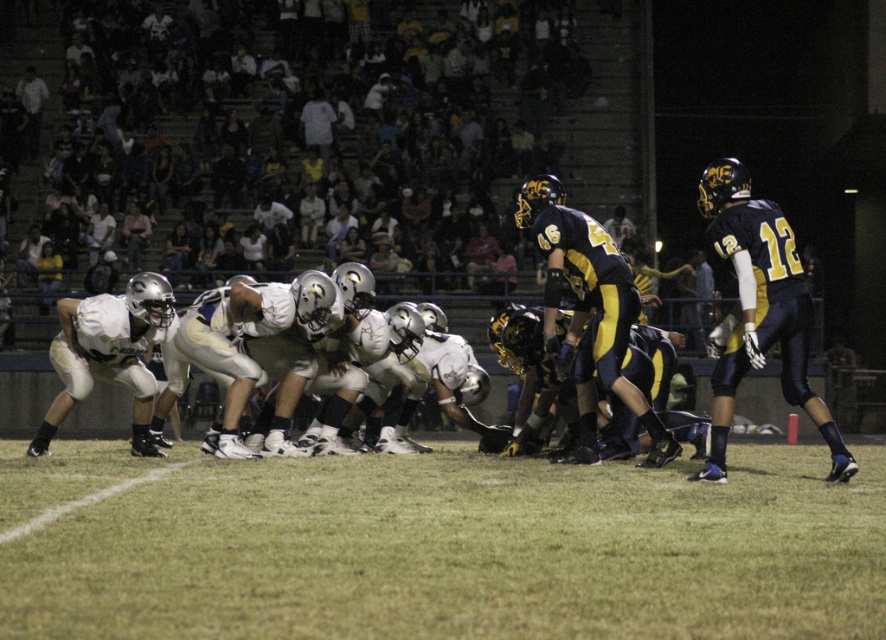
Question: Is the position of green grass at center more distant than that of white matte uniform at center?

Choices:
 (A) yes
 (B) no

Answer: (B)

Question: Does green grass at center appear over white matte uniform at center?

Choices:
 (A) no
 (B) yes

Answer: (A)

Question: Does green grass at center appear on the right side of white matte uniform at center?

Choices:
 (A) no
 (B) yes

Answer: (A)

Question: Which point is closer to the camera taking this photo?

Choices:
 (A) (95, 456)
 (B) (778, 230)

Answer: (B)

Question: Which object is closer to the camera taking this photo?

Choices:
 (A) green grass at center
 (B) white matte uniform at center

Answer: (A)

Question: Which object appears closest to the camera in this image?

Choices:
 (A) green grass at center
 (B) white matte uniform at center

Answer: (A)